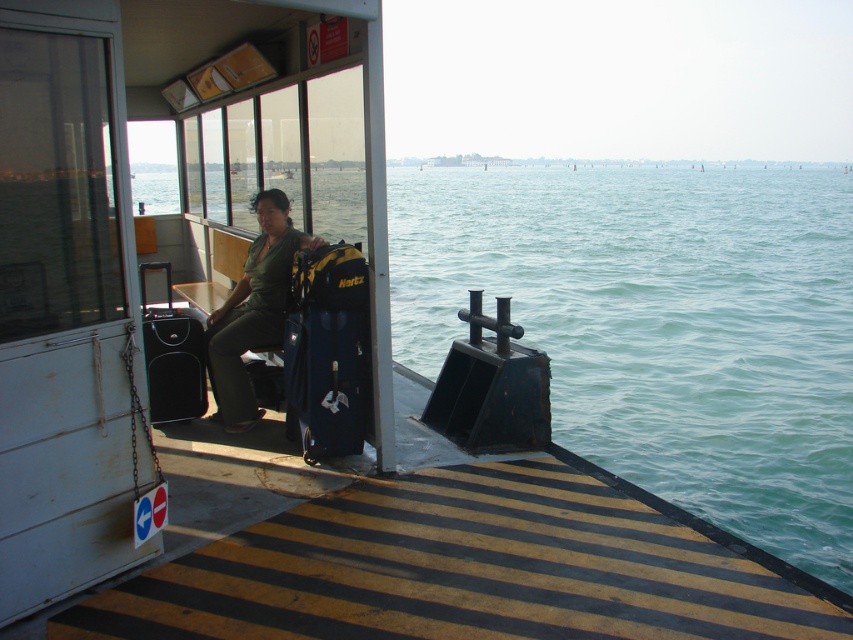
Question: Which is farther from the black fabric suitcase at left?

Choices:
 (A) green matte shirt at center
 (B) matte blue luggage at center

Answer: (B)

Question: Does green matte shirt at center lie behind black fabric suitcase at left?

Choices:
 (A) yes
 (B) no

Answer: (B)

Question: Is matte blue luggage at center to the right of black fabric suitcase at left from the viewer's perspective?

Choices:
 (A) no
 (B) yes

Answer: (B)

Question: Among these points, which one is nearest to the camera?

Choices:
 (A) (347, 451)
 (B) (282, 195)
 (C) (189, 394)

Answer: (A)

Question: Does matte blue luggage at center have a greater width compared to green matte shirt at center?

Choices:
 (A) no
 (B) yes

Answer: (A)

Question: Which of the following is the closest to the observer?

Choices:
 (A) (258, 307)
 (B) (155, 413)
 (C) (323, 288)

Answer: (C)